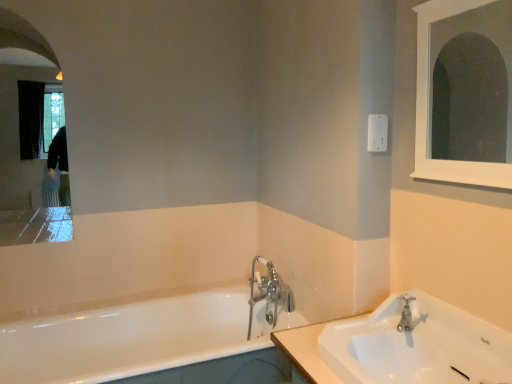
Image resolution: width=512 pixels, height=384 pixels. In order to click on silver metallic faucet at sink right, the 1th tap from the right in this screenshot , I will do `click(406, 315)`.

Find the location of a particular element. The width and height of the screenshot is (512, 384). white glossy medicine cabinet at upper left, which ranks as the second medicine cabinet in right-to-left order is located at coordinates (28, 136).

Describe the element at coordinates (429, 108) in the screenshot. I see `white wooden medicine cabinet at upper right, arranged as the 2th medicine cabinet when viewed from the back` at that location.

Locate an element on the screen. This screenshot has height=384, width=512. white plastic electric outlet at upper right is located at coordinates (377, 133).

In order to click on chrome metallic faucet at center, the first tap from the left in this screenshot , I will do `click(268, 293)`.

You are a GUI agent. You are given a task and a screenshot of the screen. Output one action in this format:
    pyautogui.click(x=<x>, y=<y>)
    Task: Click on the silver metallic faucet at sink right, which is counted as the 1th tap, starting from the front
    The width and height of the screenshot is (512, 384).
    Given the screenshot: What is the action you would take?
    pyautogui.click(x=406, y=315)

From the image's perspective, is white glossy medicine cabinet at upper left, the 2th medicine cabinet positioned from the front, on white glossy sink at lower right?

Correct, white glossy medicine cabinet at upper left, the 2th medicine cabinet positioned from the front, appears higher than white glossy sink at lower right in the image.

Which of these two, white glossy medicine cabinet at upper left, the 2th medicine cabinet positioned from the front, or white glossy sink at lower right, stands taller?

Standing taller between the two is white glossy medicine cabinet at upper left, the 2th medicine cabinet positioned from the front.

Which object is positioned more to the left, white glossy medicine cabinet at upper left, which ranks as the second medicine cabinet in right-to-left order, or white glossy sink at lower right?

From the viewer's perspective, white glossy medicine cabinet at upper left, which ranks as the second medicine cabinet in right-to-left order, appears more on the left side.

How many degrees apart are the facing directions of white glossy medicine cabinet at upper left, the 2th medicine cabinet positioned from the front, and white glossy sink at lower right?

89.5 degrees separate the facing orientations of white glossy medicine cabinet at upper left, the 2th medicine cabinet positioned from the front, and white glossy sink at lower right.

Between white wooden medicine cabinet at upper right, arranged as the 2th medicine cabinet when viewed from the back, and white glossy sink at lower right, which one has less height?

white glossy sink at lower right is shorter.

Between white wooden medicine cabinet at upper right, the first medicine cabinet viewed from the right, and white glossy sink at lower right, which one is positioned in front?

white glossy sink at lower right is in front.

Would you say white wooden medicine cabinet at upper right, which ranks as the second medicine cabinet in left-to-right order, is outside white glossy sink at lower right?

Yes, white wooden medicine cabinet at upper right, which ranks as the second medicine cabinet in left-to-right order, is not within white glossy sink at lower right.

In the scene shown: Can you confirm if white wooden medicine cabinet at upper right, placed as the first medicine cabinet when sorted from front to back, is positioned to the right of white glossy sink at lower right?

Indeed, white wooden medicine cabinet at upper right, placed as the first medicine cabinet when sorted from front to back, is positioned on the right side of white glossy sink at lower right.

Is silver metallic faucet at sink right, which is counted as the 1th tap, starting from the front, at the right side of white plastic electric outlet at upper right?

Indeed, silver metallic faucet at sink right, which is counted as the 1th tap, starting from the front, is positioned on the right side of white plastic electric outlet at upper right.

Between silver metallic faucet at sink right, positioned as the 2th tap in left-to-right order, and white plastic electric outlet at upper right, which one has larger width?

silver metallic faucet at sink right, positioned as the 2th tap in left-to-right order.

What's the angular difference between silver metallic faucet at sink right, positioned as the 2th tap in left-to-right order, and white plastic electric outlet at upper right's facing directions?

1.12 degrees separate the facing orientations of silver metallic faucet at sink right, positioned as the 2th tap in left-to-right order, and white plastic electric outlet at upper right.

Looking at the image, does silver metallic faucet at sink right, the 1th tap from the right, seem bigger or smaller compared to white plastic electric outlet at upper right?

In the image, silver metallic faucet at sink right, the 1th tap from the right, appears to be larger than white plastic electric outlet at upper right.

Which is more to the left, white plastic electric outlet at upper right or white wooden medicine cabinet at upper right, placed as the first medicine cabinet when sorted from front to back?

white plastic electric outlet at upper right is more to the left.

From the image's perspective, is white plastic electric outlet at upper right under white wooden medicine cabinet at upper right, which ranks as the second medicine cabinet in left-to-right order?

Correct, white plastic electric outlet at upper right appears lower than white wooden medicine cabinet at upper right, which ranks as the second medicine cabinet in left-to-right order, in the image.

This screenshot has height=384, width=512. Identify the location of the 1st medicine cabinet above the white plastic electric outlet at upper right (from the image's perspective). (429, 108).

Are white plastic electric outlet at upper right and white wooden medicine cabinet at upper right, placed as the first medicine cabinet when sorted from front to back, beside each other?

No, white plastic electric outlet at upper right is not making contact with white wooden medicine cabinet at upper right, placed as the first medicine cabinet when sorted from front to back.

Between white plastic electric outlet at upper right and white glossy bathtub at lower left, which one is positioned in front?

white glossy bathtub at lower left is more forward.

From a real-world perspective, which object rests below the other?

white glossy bathtub at lower left.

Can we say white plastic electric outlet at upper right lies outside white glossy bathtub at lower left?

Indeed, white plastic electric outlet at upper right is completely outside white glossy bathtub at lower left.

Considering the sizes of objects white plastic electric outlet at upper right and white glossy bathtub at lower left in the image provided, who is smaller, white plastic electric outlet at upper right or white glossy bathtub at lower left?

With smaller size is white plastic electric outlet at upper right.

Is white glossy bathtub at lower left turned away from chrome metallic faucet at center, the first tap from the left?

white glossy bathtub at lower left is not turned away from chrome metallic faucet at center, the first tap from the left.

Which object is thinner, white glossy bathtub at lower left or chrome metallic faucet at center, acting as the first tap starting from the back?

chrome metallic faucet at center, acting as the first tap starting from the back, is thinner.

Is white glossy bathtub at lower left taller than chrome metallic faucet at center, the first tap from the left?

In fact, white glossy bathtub at lower left may be shorter than chrome metallic faucet at center, the first tap from the left.

Is white glossy bathtub at lower left surrounding chrome metallic faucet at center, acting as the first tap starting from the back?

Indeed, chrome metallic faucet at center, acting as the first tap starting from the back, is located within white glossy bathtub at lower left.

Is chrome metallic faucet at center, the first tap from the left, facing towards white plastic electric outlet at upper right?

No, chrome metallic faucet at center, the first tap from the left, does not turn towards white plastic electric outlet at upper right.

Would you say chrome metallic faucet at center, which ranks as the 2th tap in right-to-left order, is outside white plastic electric outlet at upper right?

Yes, chrome metallic faucet at center, which ranks as the 2th tap in right-to-left order, is not within white plastic electric outlet at upper right.

Between chrome metallic faucet at center, which ranks as the 2th tap in right-to-left order, and white plastic electric outlet at upper right, which one is positioned in front?

white plastic electric outlet at upper right is closer to the camera.

Looking at the image, does chrome metallic faucet at center, the second tap when ordered from front to back, seem bigger or smaller compared to white plastic electric outlet at upper right?

chrome metallic faucet at center, the second tap when ordered from front to back, is bigger than white plastic electric outlet at upper right.

There is a white glossy sink at lower right. What are the coordinates of `the 2nd medicine cabinet above it (from the image's perspective)` in the screenshot? It's located at pos(28,136).

Identify the location of sink below the white wooden medicine cabinet at upper right, arranged as the 2th medicine cabinet when viewed from the back (from the image's perspective). (417, 345).

When comparing their distances from white plastic electric outlet at upper right, does white glossy medicine cabinet at upper left, which is the first medicine cabinet from left to right, or silver metallic faucet at sink right, positioned as the 2th tap in left-to-right order, seem further?

Based on the image, white glossy medicine cabinet at upper left, which is the first medicine cabinet from left to right, appears to be further to white plastic electric outlet at upper right.

From the image, which object appears to be nearer to white wooden medicine cabinet at upper right, the first medicine cabinet viewed from the right, chrome metallic faucet at center, acting as the first tap starting from the back, or white glossy sink at lower right?

Based on the image, white glossy sink at lower right appears to be nearer to white wooden medicine cabinet at upper right, the first medicine cabinet viewed from the right.

Considering their positions, is white wooden medicine cabinet at upper right, which ranks as the second medicine cabinet in left-to-right order, positioned closer to white glossy bathtub at lower left than silver metallic faucet at sink right, positioned as the 2th tap in left-to-right order?

The object closer to white glossy bathtub at lower left is silver metallic faucet at sink right, positioned as the 2th tap in left-to-right order.

Which object lies nearer to the anchor point chrome metallic faucet at center, the first tap from the left, white glossy medicine cabinet at upper left, which ranks as the 1th medicine cabinet in back-to-front order, or silver metallic faucet at sink right, marked as the second tap in a back-to-front arrangement?

silver metallic faucet at sink right, marked as the second tap in a back-to-front arrangement, is closer to chrome metallic faucet at center, the first tap from the left.

From the picture: From the image, which object appears to be nearer to white glossy medicine cabinet at upper left, the 2th medicine cabinet positioned from the front, silver metallic faucet at sink right, positioned as the 2th tap in left-to-right order, or white wooden medicine cabinet at upper right, placed as the first medicine cabinet when sorted from front to back?

white wooden medicine cabinet at upper right, placed as the first medicine cabinet when sorted from front to back, lies closer to white glossy medicine cabinet at upper left, the 2th medicine cabinet positioned from the front, than the other object.

Based on their spatial positions, is chrome metallic faucet at center, which ranks as the 2th tap in right-to-left order, or white glossy bathtub at lower left closer to white glossy medicine cabinet at upper left, which ranks as the second medicine cabinet in right-to-left order?

The object closer to white glossy medicine cabinet at upper left, which ranks as the second medicine cabinet in right-to-left order, is white glossy bathtub at lower left.

From the picture: Considering their positions, is white plastic electric outlet at upper right positioned closer to white glossy medicine cabinet at upper left, the 2th medicine cabinet positioned from the front, than silver metallic faucet at sink right, marked as the second tap in a back-to-front arrangement?

The object closer to white glossy medicine cabinet at upper left, the 2th medicine cabinet positioned from the front, is white plastic electric outlet at upper right.

Estimate the real-world distances between objects in this image. Which object is closer to white glossy medicine cabinet at upper left, which is the first medicine cabinet from left to right, white glossy bathtub at lower left or white glossy sink at lower right?

white glossy bathtub at lower left.

Find the location of a particular element. This screenshot has height=384, width=512. electric outlet located between white glossy medicine cabinet at upper left, which ranks as the 1th medicine cabinet in back-to-front order, and white wooden medicine cabinet at upper right, the first medicine cabinet viewed from the right, in the left-right direction is located at coordinates (377, 133).

The width and height of the screenshot is (512, 384). I want to click on bathtub between white glossy medicine cabinet at upper left, which ranks as the second medicine cabinet in right-to-left order, and white glossy sink at lower right, so click(131, 338).

Find the location of a particular element. The height and width of the screenshot is (384, 512). sink between white glossy bathtub at lower left and white wooden medicine cabinet at upper right, which ranks as the second medicine cabinet in left-to-right order, from left to right is located at coordinates [x=417, y=345].

Find the location of a particular element. tap between white wooden medicine cabinet at upper right, placed as the first medicine cabinet when sorted from front to back, and white glossy sink at lower right vertically is located at coordinates (406, 315).